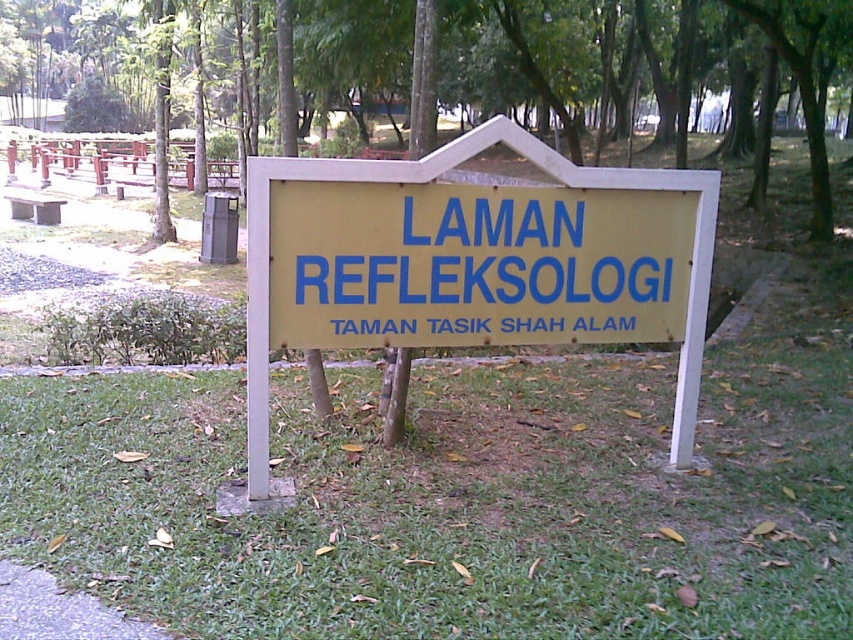
Question: Does yellow matte sign at center have a lesser width compared to yellow matte signboard at center?

Choices:
 (A) yes
 (B) no

Answer: (B)

Question: Which object is positioned closest to the yellow matte signboard at center?

Choices:
 (A) yellow matte sign at center
 (B) green grass at center

Answer: (A)

Question: Can you confirm if green grass at center is positioned below yellow matte sign at center?

Choices:
 (A) no
 (B) yes

Answer: (B)

Question: Estimate the real-world distances between objects in this image. Which object is closer to the yellow matte sign at center?

Choices:
 (A) yellow matte signboard at center
 (B) green grass at center

Answer: (A)

Question: Among these objects, which one is nearest to the camera?

Choices:
 (A) yellow matte signboard at center
 (B) green grass at center

Answer: (B)

Question: Does green grass at center appear under yellow matte signboard at center?

Choices:
 (A) yes
 (B) no

Answer: (A)